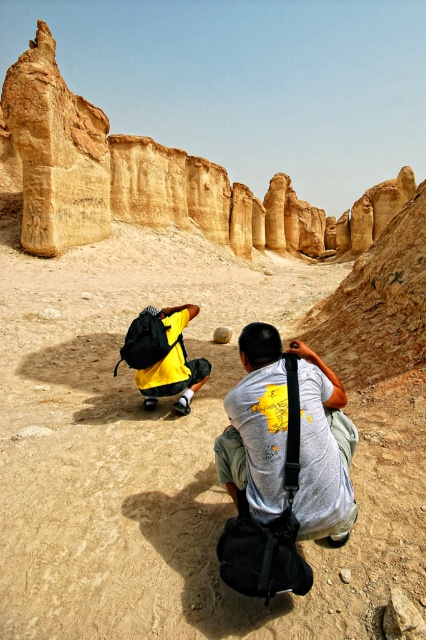
You are a hiker planning to take a photo of the sandstone rock formation at upper left from the smooth sandstone rock at center. Based on the distance between them, will you be able to capture the entire formation in one shot without moving your camera position?

The smooth sandstone rock at center is 60.29 meters away from the sandstone rock formation at upper left. Depending on your camera lens, if it has a wide enough angle or zoom capability, you might be able to capture the entire formation in one shot from that distance. However, if the formation is large, you may need to adjust your position or use a wider lens.

You are standing in the desert scene described. You need to place a marker exactly at the center of the image. Is the smooth sandstone rock at center located to the left or right of the marker?

The smooth sandstone rock at center is located at the center of the image, so it would be exactly where the marker is placed.